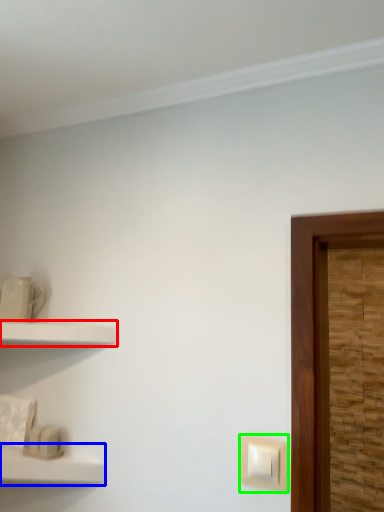
Question: Which object is the closest to the shelf (highlighted by a red box)? Choose among these: shelf (highlighted by a blue box) or light switch (highlighted by a green box).

Choices:
 (A) shelf
 (B) light switch

Answer: (A)